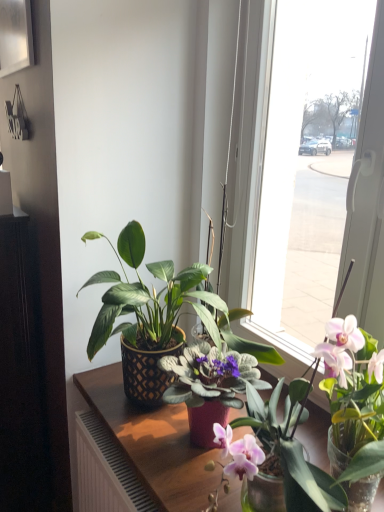
Question: Is metallic silver picture frame at upper left aimed at wooden table at center?

Choices:
 (A) yes
 (B) no

Answer: (B)

Question: Is metallic silver picture frame at upper left to the right of wooden table at center from the viewer's perspective?

Choices:
 (A) yes
 (B) no

Answer: (B)

Question: From the image's perspective, is metallic silver picture frame at upper left under wooden table at center?

Choices:
 (A) no
 (B) yes

Answer: (A)

Question: Is metallic silver picture frame at upper left located outside wooden table at center?

Choices:
 (A) no
 (B) yes

Answer: (B)

Question: Can you confirm if metallic silver picture frame at upper left is positioned to the left of wooden table at center?

Choices:
 (A) no
 (B) yes

Answer: (B)

Question: Is the depth of metallic silver picture frame at upper left less than that of wooden table at center?

Choices:
 (A) yes
 (B) no

Answer: (B)

Question: Is metallic silver picture frame at upper left completely or partially inside matte black pot at center?

Choices:
 (A) yes
 (B) no

Answer: (B)

Question: Is matte black pot at center at the left side of metallic silver picture frame at upper left?

Choices:
 (A) no
 (B) yes

Answer: (A)

Question: Can you confirm if matte black pot at center is shorter than metallic silver picture frame at upper left?

Choices:
 (A) yes
 (B) no

Answer: (B)

Question: Is the position of matte black pot at center more distant than that of metallic silver picture frame at upper left?

Choices:
 (A) yes
 (B) no

Answer: (B)

Question: From a real-world perspective, is matte black pot at center under metallic silver picture frame at upper left?

Choices:
 (A) no
 (B) yes

Answer: (B)

Question: Is matte black pot at center positioned with its back to metallic silver picture frame at upper left?

Choices:
 (A) no
 (B) yes

Answer: (A)

Question: Is metallic silver picture frame at upper left positioned beyond the bounds of matte black pot at center?

Choices:
 (A) yes
 (B) no

Answer: (A)